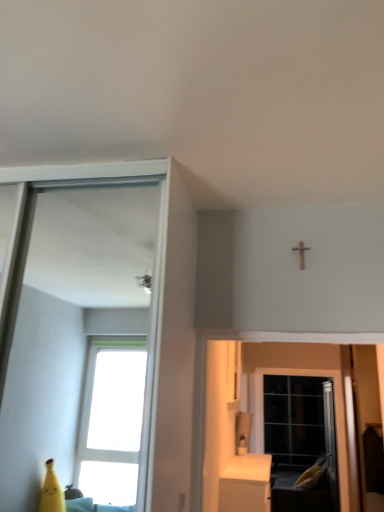
Locate an element on the screen. The height and width of the screenshot is (512, 384). white glossy cabinet at lower right is located at coordinates (246, 484).

This screenshot has width=384, height=512. What do you see at coordinates (246, 484) in the screenshot?
I see `white glossy cabinet at lower right` at bounding box center [246, 484].

The height and width of the screenshot is (512, 384). What do you see at coordinates (263, 414) in the screenshot?
I see `black glass screen door at lower right` at bounding box center [263, 414].

I want to click on black glass screen door at lower right, so click(x=263, y=414).

The width and height of the screenshot is (384, 512). Find the location of `white glossy cabinet at lower right`. white glossy cabinet at lower right is located at coordinates (246, 484).

Considering the positions of objects white glossy cabinet at lower right and black glass screen door at lower right in the image provided, who is more to the left, white glossy cabinet at lower right or black glass screen door at lower right?

Positioned to the left is white glossy cabinet at lower right.

Which is behind, white glossy cabinet at lower right or black glass screen door at lower right?

black glass screen door at lower right.

Between point (234, 486) and point (343, 455), which one is positioned in front?

The point (234, 486) is closer to the camera.

From the image's perspective, is white glossy cabinet at lower right under black glass screen door at lower right?

No, from the image's perspective, white glossy cabinet at lower right is not below black glass screen door at lower right.

From a real-world perspective, who is located lower, white glossy cabinet at lower right or black glass screen door at lower right?

From a 3D spatial view, white glossy cabinet at lower right is below.

Considering the sizes of objects white glossy cabinet at lower right and black glass screen door at lower right in the image provided, who is wider, white glossy cabinet at lower right or black glass screen door at lower right?

white glossy cabinet at lower right is wider.

Which of these two, white glossy cabinet at lower right or black glass screen door at lower right, stands taller?

black glass screen door at lower right is taller.

Considering the sizes of white glossy cabinet at lower right and black glass screen door at lower right in the image, is white glossy cabinet at lower right bigger or smaller than black glass screen door at lower right?

Considering their sizes, white glossy cabinet at lower right takes up more space than black glass screen door at lower right.

Which is correct: white glossy cabinet at lower right is inside black glass screen door at lower right, or outside of it?

white glossy cabinet at lower right is not enclosed by black glass screen door at lower right.

Would you consider white glossy cabinet at lower right to be distant from black glass screen door at lower right?

Yes, white glossy cabinet at lower right and black glass screen door at lower right are quite far apart.

Is white glossy cabinet at lower right oriented towards black glass screen door at lower right?

No, white glossy cabinet at lower right is not oriented towards black glass screen door at lower right.

Can you tell me how much white glossy cabinet at lower right and black glass screen door at lower right differ in facing direction?

The facing directions of white glossy cabinet at lower right and black glass screen door at lower right are 91.2 degrees apart.

Identify the location of furniture in front of the black glass screen door at lower right. (246, 484).

Is black glass screen door at lower right to the left or to the right of white glossy cabinet at lower right in the image?

black glass screen door at lower right is positioned on white glossy cabinet at lower right's right side.

Does black glass screen door at lower right lie in front of white glossy cabinet at lower right?

No, black glass screen door at lower right is further to the viewer.

Is point (335, 387) farther from viewer compared to point (257, 479)?

That is True.

From the image's perspective, is black glass screen door at lower right beneath white glossy cabinet at lower right?

Yes, from the image's perspective, black glass screen door at lower right is below white glossy cabinet at lower right.

From a real-world perspective, who is located higher, black glass screen door at lower right or white glossy cabinet at lower right?

black glass screen door at lower right.

Based on the photo, does black glass screen door at lower right have a lesser width compared to white glossy cabinet at lower right?

Correct, the width of black glass screen door at lower right is less than that of white glossy cabinet at lower right.

Who is taller, black glass screen door at lower right or white glossy cabinet at lower right?

black glass screen door at lower right is taller.

Does black glass screen door at lower right have a smaller size compared to white glossy cabinet at lower right?

Indeed, black glass screen door at lower right has a smaller size compared to white glossy cabinet at lower right.

Is white glossy cabinet at lower right completely or partially inside black glass screen door at lower right?

Definitely not — white glossy cabinet at lower right is not inside black glass screen door at lower right.

Is black glass screen door at lower right next to white glossy cabinet at lower right and touching it?

No, black glass screen door at lower right is not next to white glossy cabinet at lower right.

From the picture: Does black glass screen door at lower right turn towards white glossy cabinet at lower right?

Yes.

Can you tell me how much black glass screen door at lower right and white glossy cabinet at lower right differ in facing direction?

black glass screen door at lower right and white glossy cabinet at lower right are facing 91.2 degrees away from each other.

What are the coordinates of `furniture above the black glass screen door at lower right (from the image's perspective)` in the screenshot? It's located at (246, 484).

Locate an element on the screen. This screenshot has height=512, width=384. furniture above the black glass screen door at lower right (from the image's perspective) is located at coordinates (246, 484).

Find the location of a particular element. Image resolution: width=384 pixels, height=512 pixels. screen door that is above the white glossy cabinet at lower right (from a real-world perspective) is located at coordinates 263,414.